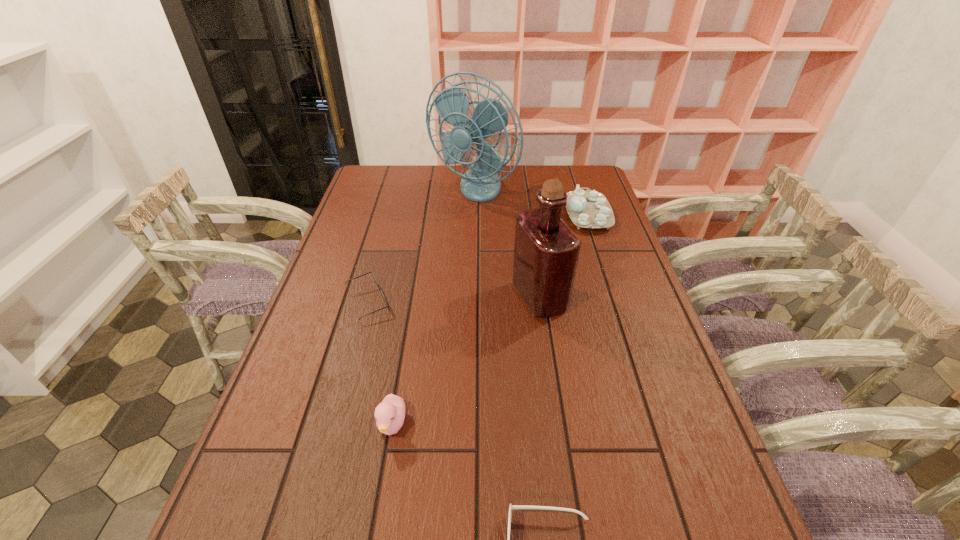
Image resolution: width=960 pixels, height=540 pixels. Identify the location of vacant space that is in between the fan and the chinaware. (531, 202).

What are the coordinates of `vacant point located between the duckling and the tallest object` in the screenshot? It's located at (433, 308).

Locate an element on the screen. This screenshot has height=540, width=960. free area in between the chinaware and the leftmost object is located at coordinates (478, 259).

The width and height of the screenshot is (960, 540). I want to click on free space between the leftmost object and the duckling, so click(x=380, y=363).

Locate an element on the screen. free area in between the chinaware and the tallest object is located at coordinates (531, 202).

This screenshot has width=960, height=540. Find the location of `vacant region between the fan and the fifth farthest object`. vacant region between the fan and the fifth farthest object is located at coordinates (433, 308).

Point out which object is positioned as the fifth nearest to the leftmost object. Please provide its 2D coordinates. Your answer should be formatted as a tuple, i.e. [(x, y)], where the tuple contains the x and y coordinates of a point satisfying the conditions above.

[(590, 209)]

This screenshot has height=540, width=960. In order to click on the fifth closest object relative to the fourth shortest object in this screenshot , I will do `click(511, 506)`.

Where is `free location that satisfies the following two spatial constraints: 1. in front of the second tallest object to blow air; 2. on the right side of the fan`? Image resolution: width=960 pixels, height=540 pixels. free location that satisfies the following two spatial constraints: 1. in front of the second tallest object to blow air; 2. on the right side of the fan is located at coordinates (470, 297).

At what (x,y) coordinates should I click in order to perform the action: click on vacant space that satisfies the following two spatial constraints: 1. on the front side of the fourth shortest object; 2. with the lenses facing outward on the spectacles. Please return your answer as a coordinate pair (x, y). The height and width of the screenshot is (540, 960). Looking at the image, I should click on (617, 302).